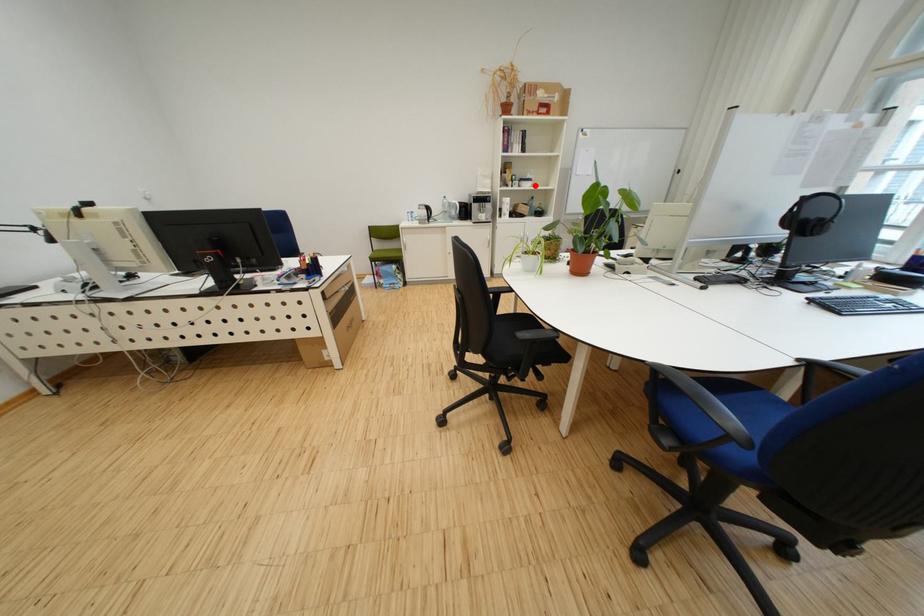
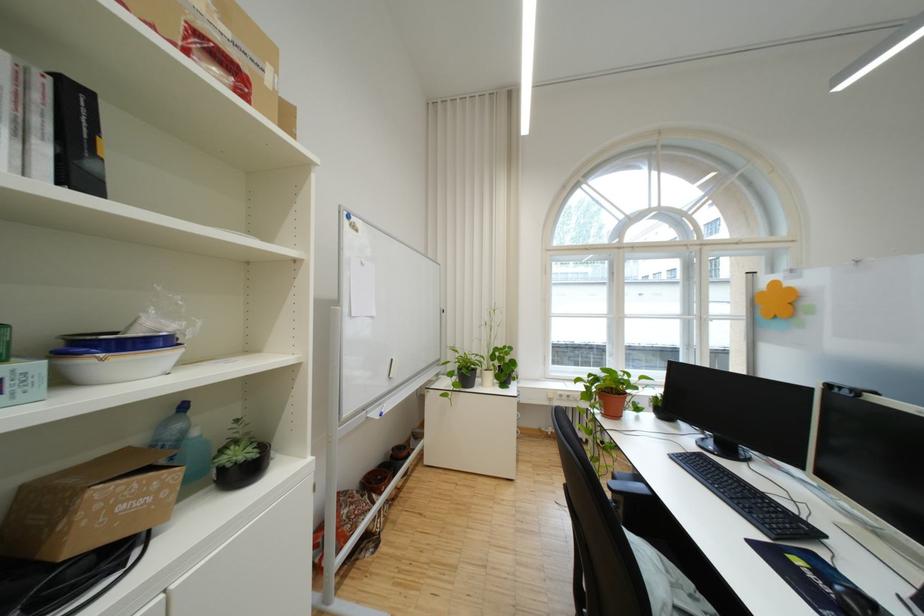
Question: I am providing you with two images of the same scene from different viewpoints. Image1 has a red point marked. In image2, the corresponding 3D location appears at what relative position? Reply with the corresponding letter.

Choices:
 (A) Closer
 (B) Farther

Answer: (B)